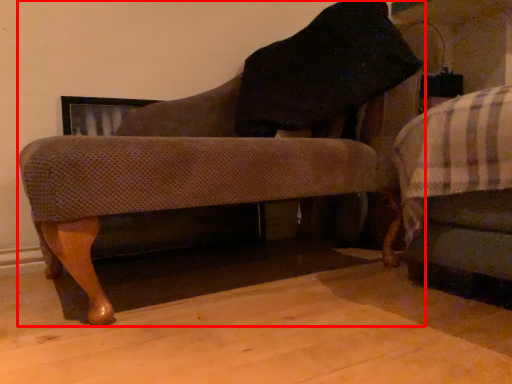
Question: Observing the image, what is the correct spatial positioning of chair (annotated by the red box) in reference to furniture?

Choices:
 (A) right
 (B) left

Answer: (B)